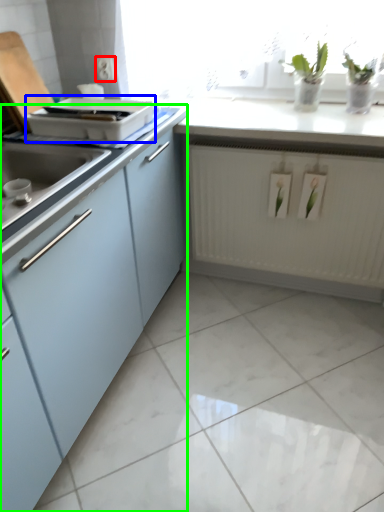
Question: Estimate the real-world distances between objects in this image. Which object is closer to electric outlet (highlighted by a red box), appliance (highlighted by a blue box) or cabinetry (highlighted by a green box)?

Choices:
 (A) appliance
 (B) cabinetry

Answer: (A)